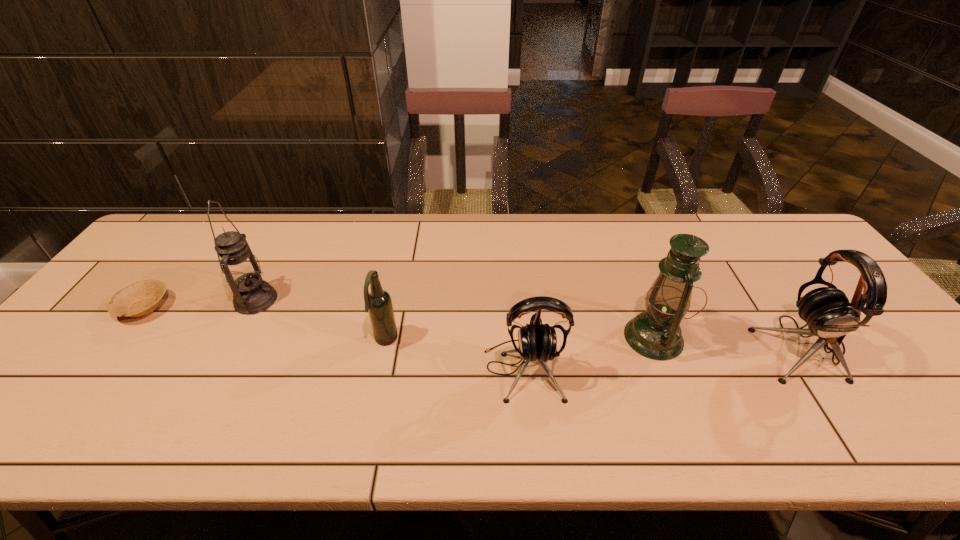
Select which object is the fifth closest to the rightmost object. Please provide its 2D coordinates. Your answer should be formatted as a tuple, i.e. [(x, y)], where the tuple contains the x and y coordinates of a point satisfying the conditions above.

[(141, 298)]

This screenshot has width=960, height=540. I want to click on object that is the fourth closest to the fifth object from right to left, so click(656, 334).

Locate an element on the screen. free location that satisfies the following two spatial constraints: 1. on the front side of the right oil lamp; 2. on the left side of the shortest object is located at coordinates click(121, 338).